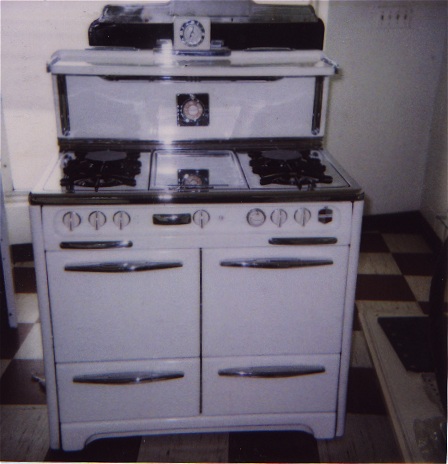
The image size is (448, 464). Identify the location of burners. (96, 175), (100, 154), (297, 173), (286, 159).